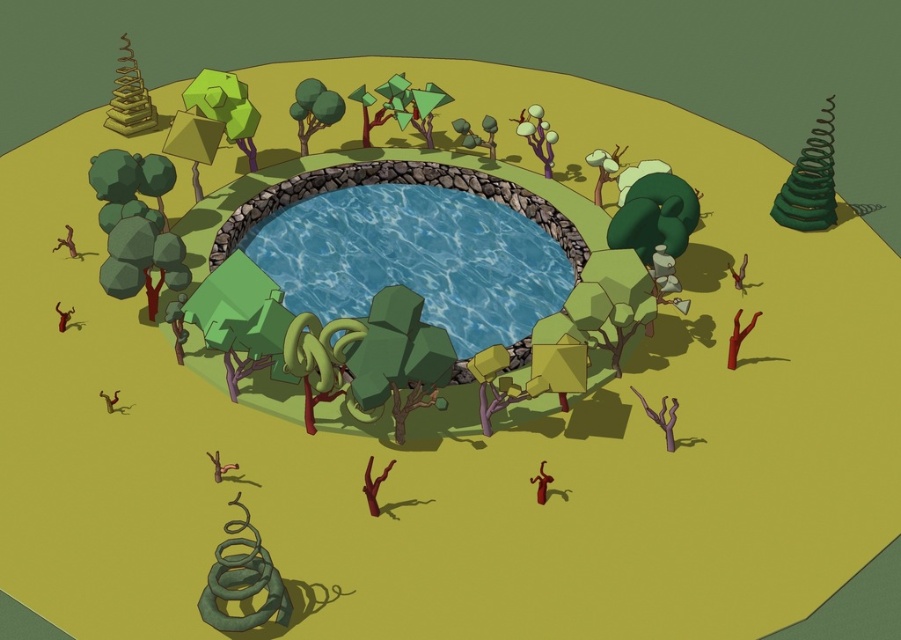
Question: Which object is positioned farthest from the green matte tree at upper center?

Choices:
 (A) green matte spiral at upper right
 (B) blue glossy pond at center
 (C) dark green matte tree at left

Answer: (A)

Question: Can you confirm if dark green matte tree at left is thinner than green matte spiral at upper right?

Choices:
 (A) yes
 (B) no

Answer: (A)

Question: From the image, what is the correct spatial relationship of dark green matte tree at left in relation to green matte spiral at upper right?

Choices:
 (A) below
 (B) above

Answer: (A)

Question: Based on their relative distances, which object is farther from the green matte tree at upper center?

Choices:
 (A) green matte spiral at upper right
 (B) blue glossy pond at center
 (C) dark green matte tree at left

Answer: (A)

Question: Which of these objects is positioned farthest from the dark green matte tree at left?

Choices:
 (A) green matte tree at upper center
 (B) blue glossy pond at center

Answer: (A)

Question: Does dark green matte tree at left come behind green matte spiral at upper right?

Choices:
 (A) yes
 (B) no

Answer: (B)